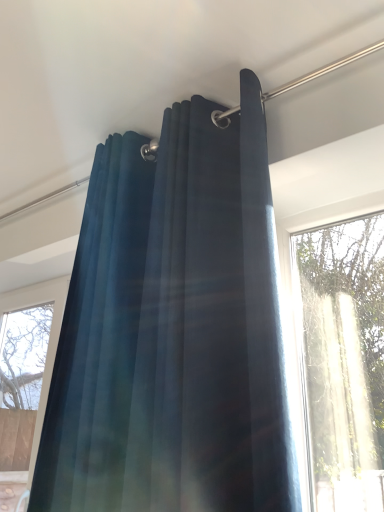
Question: Is velvet dark blue curtain at left bigger or smaller than velvet dark blue curtain at upper center?

Choices:
 (A) big
 (B) small

Answer: (B)

Question: Is velvet dark blue curtain at left wider or thinner than velvet dark blue curtain at upper center?

Choices:
 (A) wide
 (B) thin

Answer: (B)

Question: Choose the correct answer: Is velvet dark blue curtain at left inside velvet dark blue curtain at upper center or outside it?

Choices:
 (A) inside
 (B) outside

Answer: (B)

Question: Is velvet dark blue curtain at upper center to the left or to the right of velvet dark blue curtain at left in the image?

Choices:
 (A) right
 (B) left

Answer: (A)

Question: From a real-world perspective, relative to velvet dark blue curtain at left, is velvet dark blue curtain at upper center vertically above or below?

Choices:
 (A) above
 (B) below

Answer: (A)

Question: Considering the positions of point (86, 441) and point (91, 388), is point (86, 441) closer or farther from the camera than point (91, 388)?

Choices:
 (A) farther
 (B) closer

Answer: (B)

Question: Is velvet dark blue curtain at upper center wider or thinner than velvet dark blue curtain at left?

Choices:
 (A) wide
 (B) thin

Answer: (A)